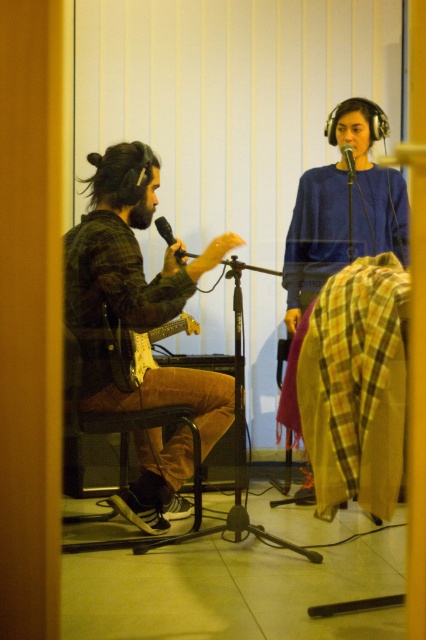
Question: Which point appears closest to the camera in this image?

Choices:
 (A) (118, 173)
 (B) (176, 262)

Answer: (A)

Question: Can you confirm if flannel shirt at left is positioned above brown leather chair at left?

Choices:
 (A) no
 (B) yes

Answer: (B)

Question: Which point is closer to the camera?

Choices:
 (A) (347, 164)
 (B) (101, 246)

Answer: (B)

Question: Does wooden acoustic guitar at center appear over matte black microphone at upper center?

Choices:
 (A) no
 (B) yes

Answer: (A)

Question: Does flannel shirt at left appear under blue cotton sweater at upper center?

Choices:
 (A) yes
 (B) no

Answer: (A)

Question: Based on their relative distances, which object is nearer to the matte black microphone at upper center?

Choices:
 (A) flannel shirt at left
 (B) brown leather chair at left
 (C) wooden acoustic guitar at center

Answer: (A)